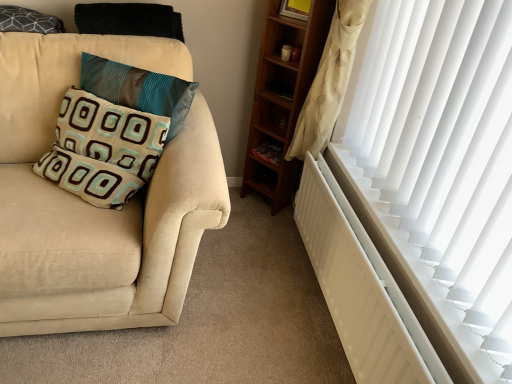
Question: From the image's perspective, is teal fabric pillow at left, the second pillow when ordered from bottom to top, located beneath dark gray textured pillow at upper left, the 3th pillow when ordered from bottom to top?

Choices:
 (A) yes
 (B) no

Answer: (A)

Question: Is the depth of teal fabric pillow at left, the second pillow when ordered from bottom to top, less than that of dark gray textured pillow at upper left, the 3th pillow when ordered from bottom to top?

Choices:
 (A) no
 (B) yes

Answer: (B)

Question: Can you confirm if teal fabric pillow at left, which is the second pillow in top-to-bottom order, is positioned to the right of dark gray textured pillow at upper left, the 3th pillow when ordered from bottom to top?

Choices:
 (A) yes
 (B) no

Answer: (A)

Question: Is teal fabric pillow at left, the second pillow when ordered from bottom to top, looking in the opposite direction of dark gray textured pillow at upper left, which ranks as the first pillow in top-to-bottom order?

Choices:
 (A) yes
 (B) no

Answer: (B)

Question: Considering the relative sizes of teal fabric pillow at left, which is the second pillow in top-to-bottom order, and dark gray textured pillow at upper left, which ranks as the first pillow in top-to-bottom order, in the image provided, is teal fabric pillow at left, which is the second pillow in top-to-bottom order, wider than dark gray textured pillow at upper left, which ranks as the first pillow in top-to-bottom order,?

Choices:
 (A) yes
 (B) no

Answer: (A)

Question: Is teal fabric pillow at left, the second pillow when ordered from bottom to top, oriented towards dark gray textured pillow at upper left, which ranks as the first pillow in top-to-bottom order?

Choices:
 (A) yes
 (B) no

Answer: (B)

Question: Can you confirm if teal fabric pillow at left, the second pillow when ordered from bottom to top, is shorter than white matte radiator at right?

Choices:
 (A) no
 (B) yes

Answer: (B)

Question: Does teal fabric pillow at left, the second pillow when ordered from bottom to top, come in front of white matte radiator at right?

Choices:
 (A) yes
 (B) no

Answer: (B)

Question: From the image's perspective, is teal fabric pillow at left, the second pillow when ordered from bottom to top, under white matte radiator at right?

Choices:
 (A) no
 (B) yes

Answer: (A)

Question: Can you see teal fabric pillow at left, which is the second pillow in top-to-bottom order, touching white matte radiator at right?

Choices:
 (A) no
 (B) yes

Answer: (A)

Question: Is teal fabric pillow at left, the second pillow when ordered from bottom to top, thinner than white matte radiator at right?

Choices:
 (A) no
 (B) yes

Answer: (A)

Question: Can we say teal fabric pillow at left, the second pillow when ordered from bottom to top, lies outside wooden bookshelf at center?

Choices:
 (A) no
 (B) yes

Answer: (B)